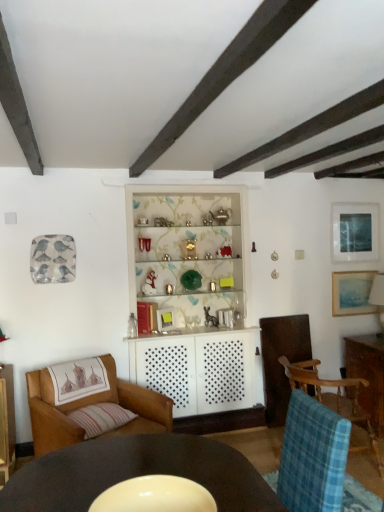
Question: Can you confirm if striped fabric pillow at lower left is bigger than blue plaid fabric chair at lower right, which is the 2th chair from left to right?

Choices:
 (A) yes
 (B) no

Answer: (B)

Question: Is striped fabric pillow at lower left outside blue plaid fabric chair at lower right, the first chair in the right-to-left sequence?

Choices:
 (A) no
 (B) yes

Answer: (B)

Question: From a real-world perspective, is striped fabric pillow at lower left over blue plaid fabric chair at lower right, the first chair in the right-to-left sequence?

Choices:
 (A) yes
 (B) no

Answer: (A)

Question: Considering the relative sizes of striped fabric pillow at lower left and blue plaid fabric chair at lower right, the first chair in the right-to-left sequence, in the image provided, is striped fabric pillow at lower left taller than blue plaid fabric chair at lower right, the first chair in the right-to-left sequence,?

Choices:
 (A) no
 (B) yes

Answer: (A)

Question: From the image's perspective, is striped fabric pillow at lower left beneath blue plaid fabric chair at lower right, which is the 2th chair from left to right?

Choices:
 (A) yes
 (B) no

Answer: (B)

Question: Does striped fabric pillow at lower left come in front of blue plaid fabric chair at lower right, the first chair in the right-to-left sequence?

Choices:
 (A) no
 (B) yes

Answer: (B)

Question: Does blue plaid fabric chair at lower right, the first chair in the right-to-left sequence, have a lesser width compared to matte blue painting at upper right, the second picture frame positioned from the bottom?

Choices:
 (A) no
 (B) yes

Answer: (A)

Question: Would you say blue plaid fabric chair at lower right, which is the 2th chair from left to right, contains matte blue painting at upper right, the first picture frame viewed from the top?

Choices:
 (A) no
 (B) yes

Answer: (A)

Question: Is blue plaid fabric chair at lower right, which is the 2th chair from left to right, oriented towards matte blue painting at upper right, the first picture frame viewed from the top?

Choices:
 (A) no
 (B) yes

Answer: (A)

Question: Is blue plaid fabric chair at lower right, the first chair in the right-to-left sequence, to the left of matte blue painting at upper right, the second picture frame positioned from the bottom, from the viewer's perspective?

Choices:
 (A) no
 (B) yes

Answer: (B)

Question: Is blue plaid fabric chair at lower right, which is the 2th chair from left to right, oriented away from matte blue painting at upper right, the second picture frame positioned from the bottom?

Choices:
 (A) no
 (B) yes

Answer: (A)

Question: Is blue plaid fabric chair at lower right, which is the 2th chair from left to right, at the right side of matte blue painting at upper right, the first picture frame viewed from the top?

Choices:
 (A) no
 (B) yes

Answer: (A)

Question: Are striped fabric pillow at lower left and matte blue painting at upper right, which is the second picture frame from top to bottom, beside each other?

Choices:
 (A) yes
 (B) no

Answer: (B)